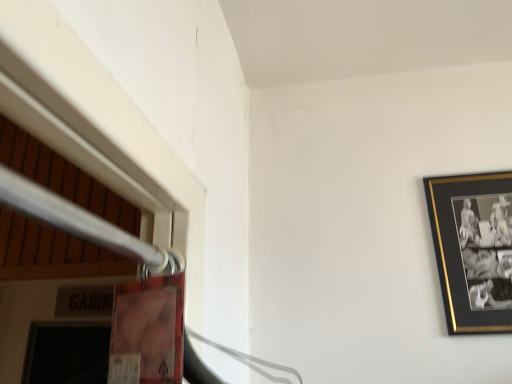
What do you see at coordinates (473, 249) in the screenshot?
I see `black matte picture frame at upper right` at bounding box center [473, 249].

Locate an element on the screen. The image size is (512, 384). black matte picture frame at upper right is located at coordinates (473, 249).

Find the location of a particular element. The width and height of the screenshot is (512, 384). black matte picture frame at upper right is located at coordinates (473, 249).